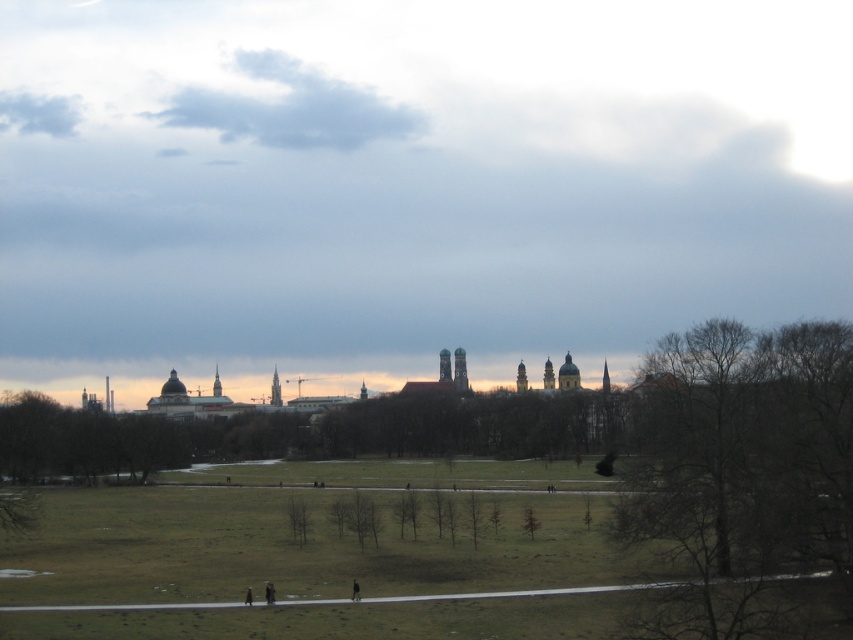
Question: Is bare wood tree at center thinner than dark brown leather jacket at lower center?

Choices:
 (A) yes
 (B) no

Answer: (B)

Question: Which object appears closest to the camera in this image?

Choices:
 (A) dark brown leather jacket at lower center
 (B) dark gray clothing at center

Answer: (A)

Question: Where is bare wood tree at center located in relation to dark brown leather jacket at lower center in the image?

Choices:
 (A) left
 (B) right

Answer: (B)

Question: Estimate the real-world distances between objects in this image. Which object is closer to the bare wood tree at center?

Choices:
 (A) black fabric person at lower center
 (B) dark gray clothing at center

Answer: (B)

Question: Can you confirm if dark gray clothing at center is positioned to the right of black fabric person at lower center?

Choices:
 (A) yes
 (B) no

Answer: (A)

Question: Based on their relative distances, which object is farther from the dark gray clothing at center?

Choices:
 (A) bare wood tree at center
 (B) dark brown leather jacket at lower center
 (C) black fabric person at lower center

Answer: (A)